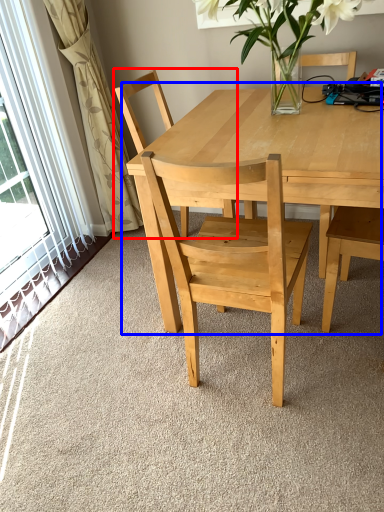
Question: Which object appears closest to the camera in this image, chair (highlighted by a red box) or kitchen & dining room table (highlighted by a blue box)?

Choices:
 (A) chair
 (B) kitchen & dining room table

Answer: (B)